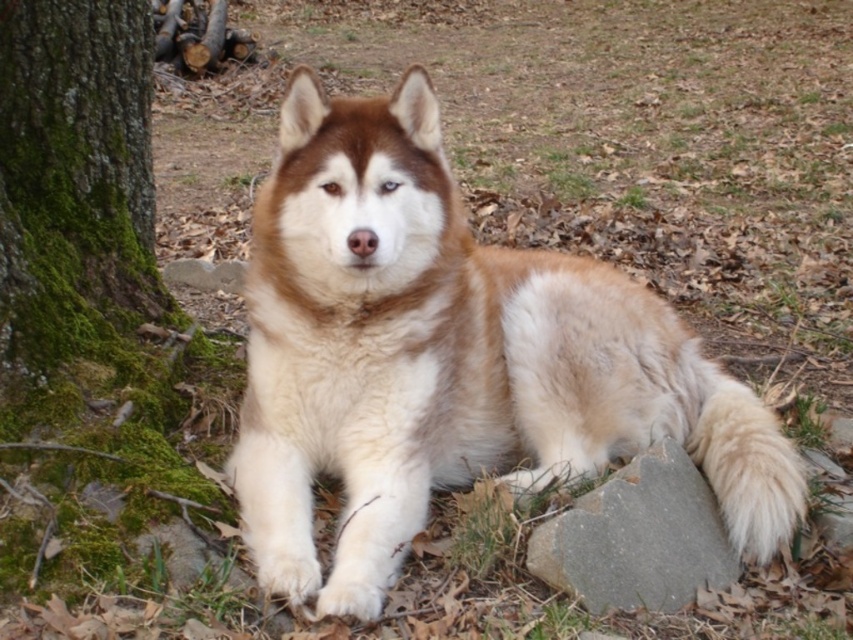
You are a photographer trying to capture a closeup of the brown and white fur dog at center while also including the green mossy bark at left in the background. Given that your camera has a depth of field that can sharply focus on objects within 25 inches of the subject, will both the dog and the mossy bark be in focus?

The brown and white fur dog at center and green mossy bark at left are 25.23 inches apart. Since the depth of field can focus within 25 inches, the distance between them exceeds this limit by 0.23 inches. Therefore, the mossy bark at left will be slightly out of focus while the dog remains sharp.

You are a photographer standing at the center of the scene. You want to take a photo that includes both the point at point (550, 252) and point (560, 556). Which point is closer to your camera?

Point (560, 556) is closer to the camera because it is positioned behind point (550, 252).